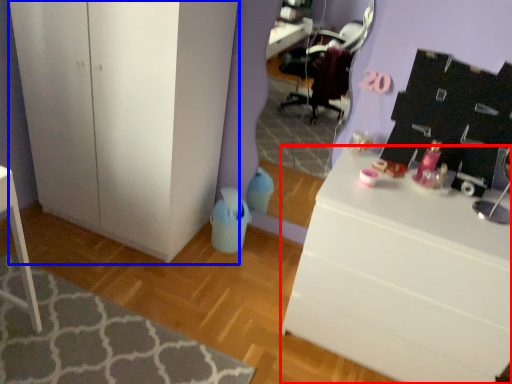
Question: Among these objects, which one is nearest to the camera, desk (highlighted by a red box) or cabinetry (highlighted by a blue box)?

Choices:
 (A) desk
 (B) cabinetry

Answer: (A)